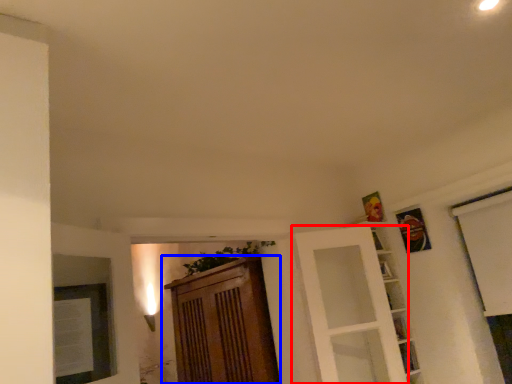
Question: Among these objects, which one is nearest to the camera, door (highlighted by a red box) or cabinetry (highlighted by a blue box)?

Choices:
 (A) door
 (B) cabinetry

Answer: (A)